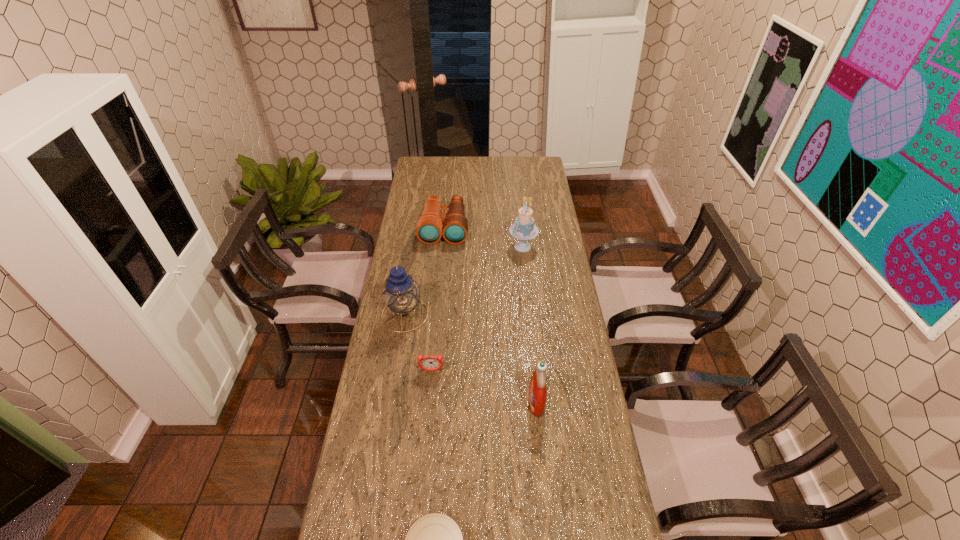
Locate an element on the screen. This screenshot has width=960, height=540. vacant space located 0.070m on the front surface of the fourth shortest object is located at coordinates (507, 402).

Image resolution: width=960 pixels, height=540 pixels. Identify the location of vacant region located 0.080m on the front surface of the fourth shortest object. (503, 402).

This screenshot has width=960, height=540. In order to click on free spot located on the front surface of the fourth shortest object in this screenshot , I will do [x=503, y=402].

Locate an element on the screen. vacant point located through the lenses of the binoculars is located at coordinates (440, 280).

Find the location of `blank area located 0.120m on the front-facing side of the third nearest object`. blank area located 0.120m on the front-facing side of the third nearest object is located at coordinates (428, 405).

Where is `lantern at the left edge`? This screenshot has width=960, height=540. lantern at the left edge is located at coordinates (401, 293).

The height and width of the screenshot is (540, 960). I want to click on binoculars that is at the left edge, so click(429, 230).

Find the location of `object at the right edge`. object at the right edge is located at coordinates (524, 229).

This screenshot has width=960, height=540. Identify the location of vacant region at the far edge. [x=496, y=160].

I want to click on vacant space at the left edge of the desktop, so click(x=430, y=181).